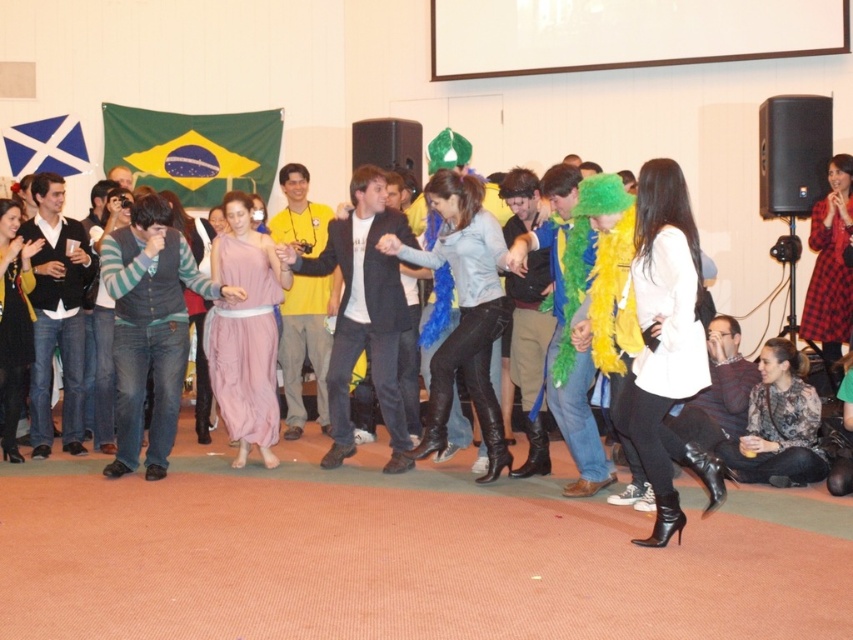
You are a photographer standing at the entrance of the room. You need to capture a photo that includes both the striped sweater at center and the blue fabric flag at upper left. Given that your camera has a maximum focus range of 12 feet, will you be able to include both in the same frame without moving your position?

The distance between the striped sweater at center and the blue fabric flag at upper left is 12.49 feet. Since your camera can only focus up to 12 feet, you won cannot include both in the same frame without moving your position.

You are a photographer at the event and want to capture both the matte black dress at center and the blue fabric flag at upper left in a single frame. Given their sizes, which object will appear smaller in the photo?

The matte black dress at center will appear smaller in the photo since it has a smaller size compared to the blue fabric flag at upper left.

You are a photographer at the event and want to capture a photo where the matte black dress at center is visible without being blocked by the blue fabric flag at upper left. Is this possible?

The matte black dress at center is located below the blue fabric flag at upper left, so it will not be blocked by the flag and can be captured clearly.